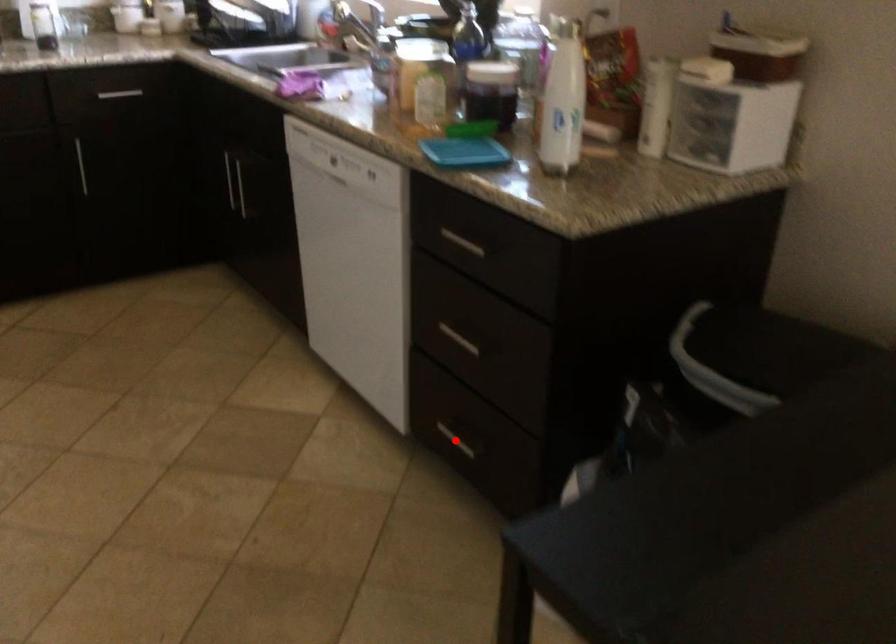
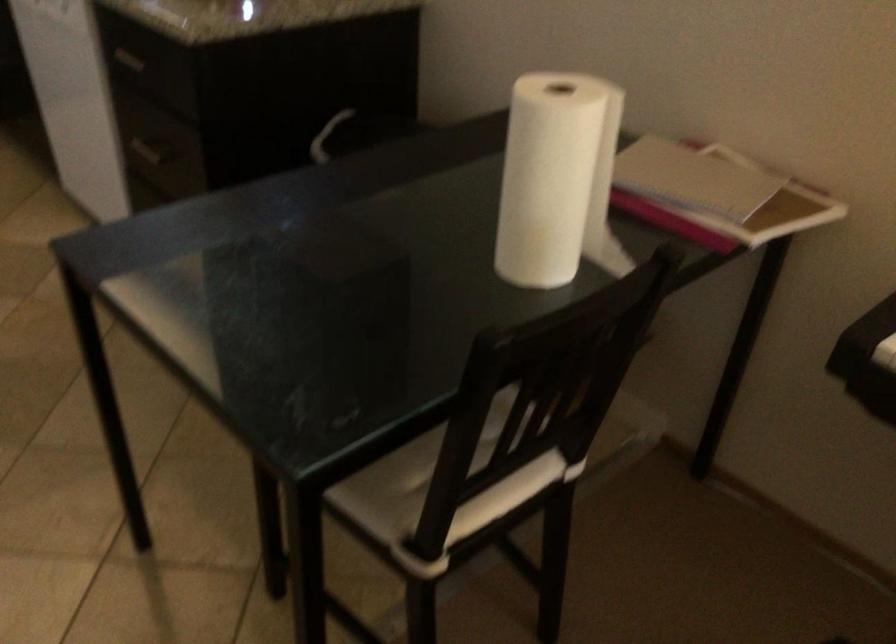
Question: I am providing you with two images of the same scene from different viewpoints. A red point is marked on the first image. Is the red point's position out of view in image 2?

Choices:
 (A) Yes
 (B) No

Answer: (A)